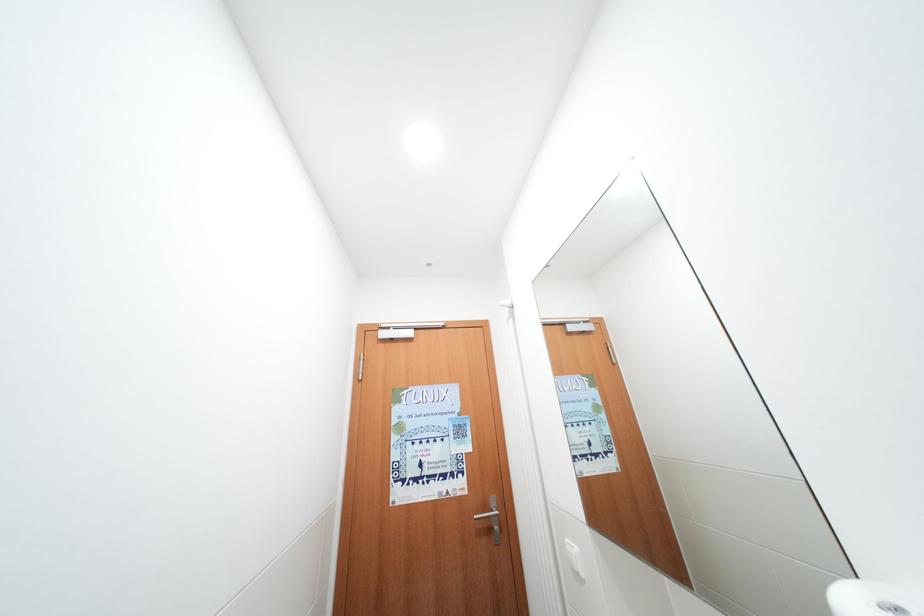
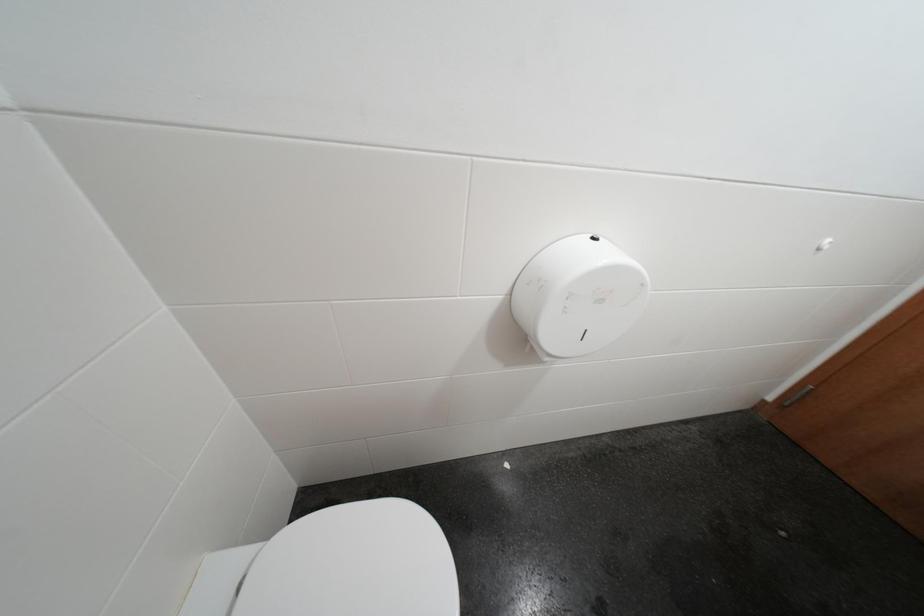
In the scene shown: First-person continuous shooting, in which direction is the camera rotating?

The camera's rotation is toward left-down.